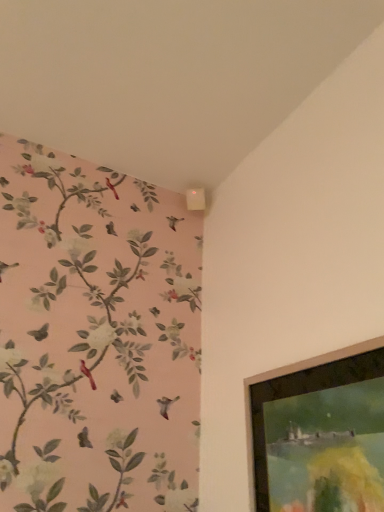
The height and width of the screenshot is (512, 384). What are the coordinates of `wooden picture frame at upper right` in the screenshot? It's located at (282, 378).

What do you see at coordinates (282, 378) in the screenshot? The image size is (384, 512). I see `wooden picture frame at upper right` at bounding box center [282, 378].

The image size is (384, 512). In order to click on wooden picture frame at upper right in this screenshot , I will do `click(282, 378)`.